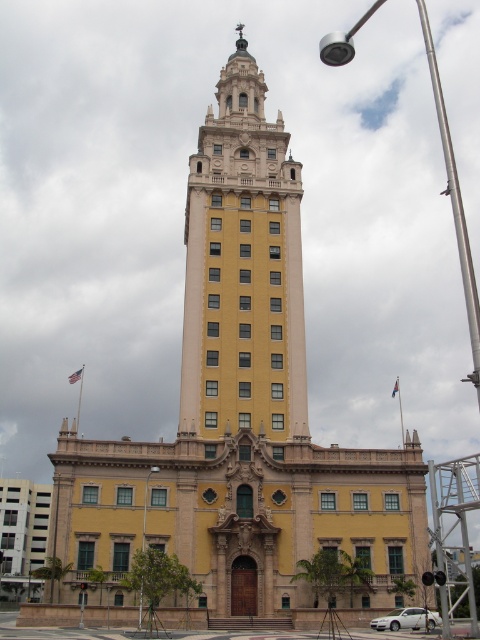
You are standing in front of the grand historic building and want to take a photo of the yellow stone tower at center. If you are positioned at the entrance area, which is on the left side of the building, should you move to your right or left to get the tower in the frame?

Since the yellow stone tower at center is positioned at coordinates 0.420 on the x and 0.506 on the y, and you are at the entrance on the left side, you should move to your right to center the tower in your photo.

You are an architect analyzing the symmetry of the building in the image. The silver metallic pole at upper center is part of the tower. Based on its coordinates, does it align with the central axis of the tower?

The silver metallic pole at upper center is positioned at coordinates point (455, 204), which indicates it is not centered on the tower. Therefore, it does not align with the central axis of the tower.